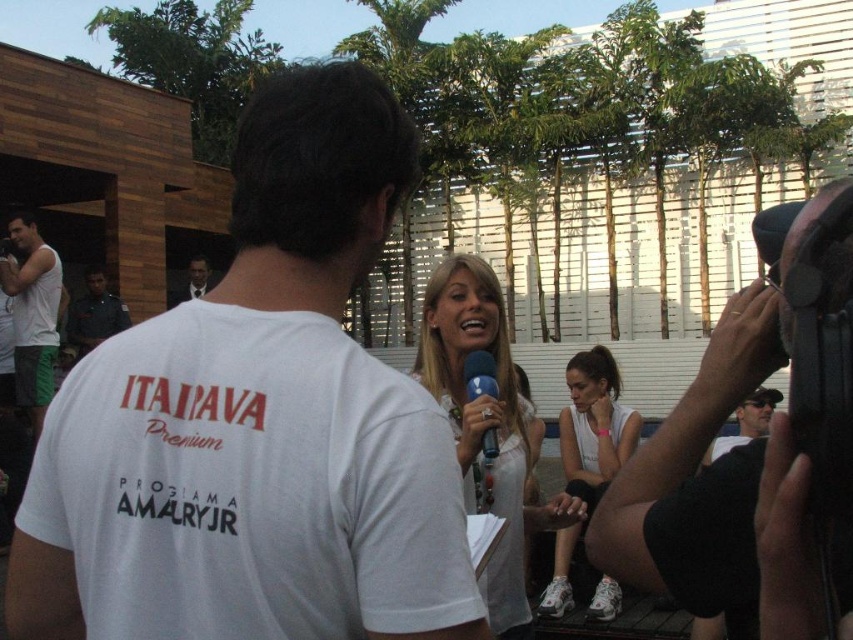
Is point (88, 317) closer to camera compared to point (492, 428)?

That is False.

Between point (105, 324) and point (492, 387), which one is positioned in front?

Point (492, 387) is more forward.

Locate an element on the screen. This screenshot has height=640, width=853. dark green uniform at left is located at coordinates (94, 314).

Is white cotton tank top at left smaller than dark green uniform at left?

Incorrect, white cotton tank top at left is not smaller in size than dark green uniform at left.

Is point (38, 420) positioned behind point (103, 314)?

No, (38, 420) is in front of (103, 314).

Which is in front, point (51, 310) or point (80, 346)?

Point (51, 310) is in front.

Identify the location of white cotton tank top at left. (32, 314).

Can you confirm if white matte t-shirt at center is positioned above black plastic microphone at center?

Correct, white matte t-shirt at center is located above black plastic microphone at center.

Who is more forward, (55, 412) or (492, 435)?

Point (55, 412) is in front.

The height and width of the screenshot is (640, 853). I want to click on white matte t-shirt at center, so click(x=257, y=424).